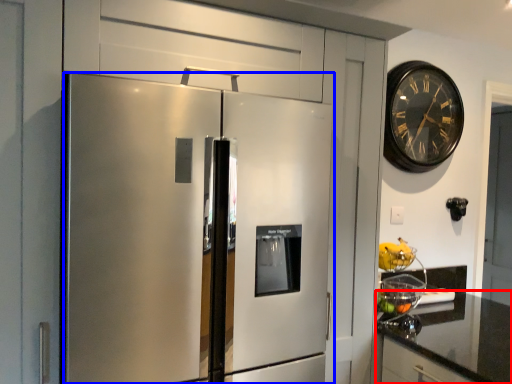
Question: Which object appears closest to the camera in this image, countertop (highlighted by a red box) or refrigerator (highlighted by a blue box)?

Choices:
 (A) countertop
 (B) refrigerator

Answer: (B)